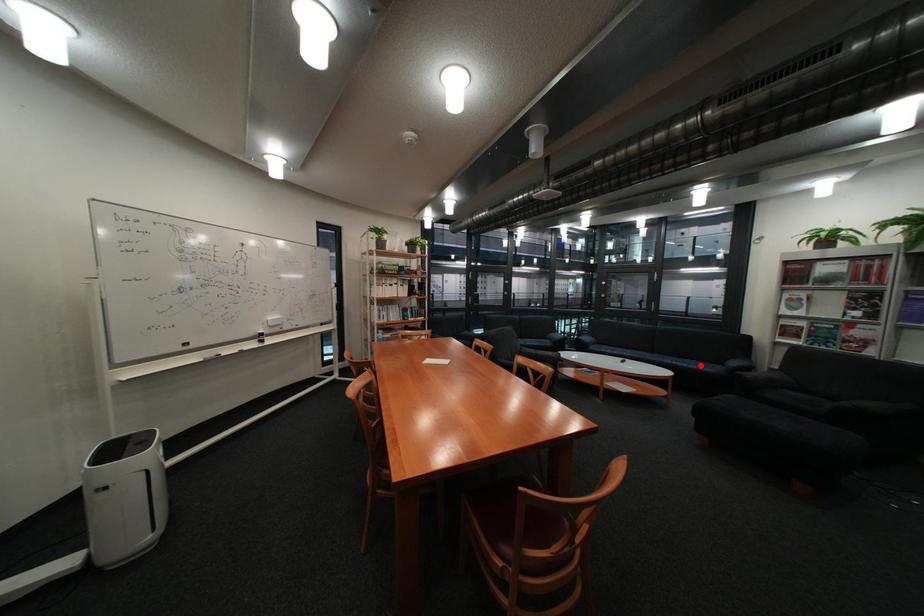
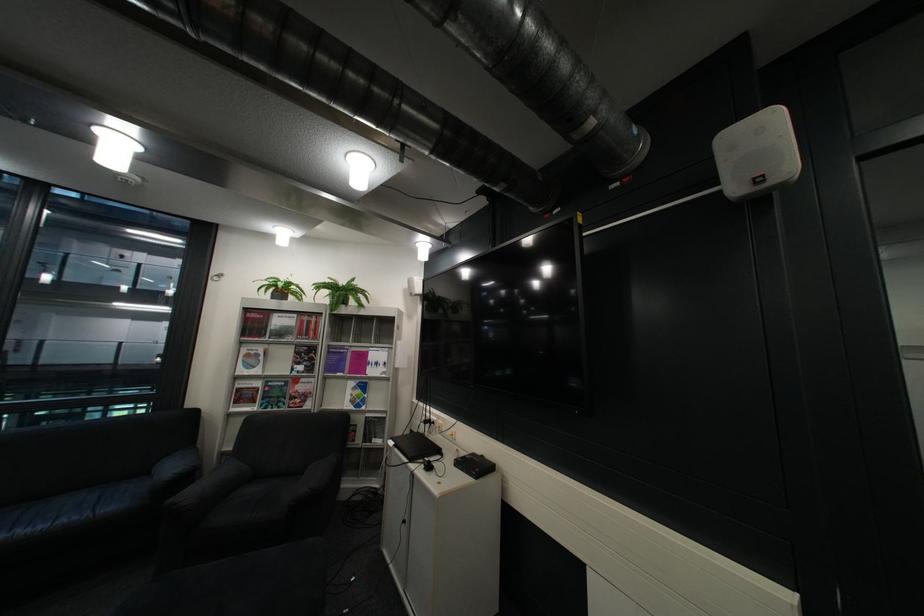
Find the pixel in the second image that matches the highlighted location in the first image.

(58, 527)